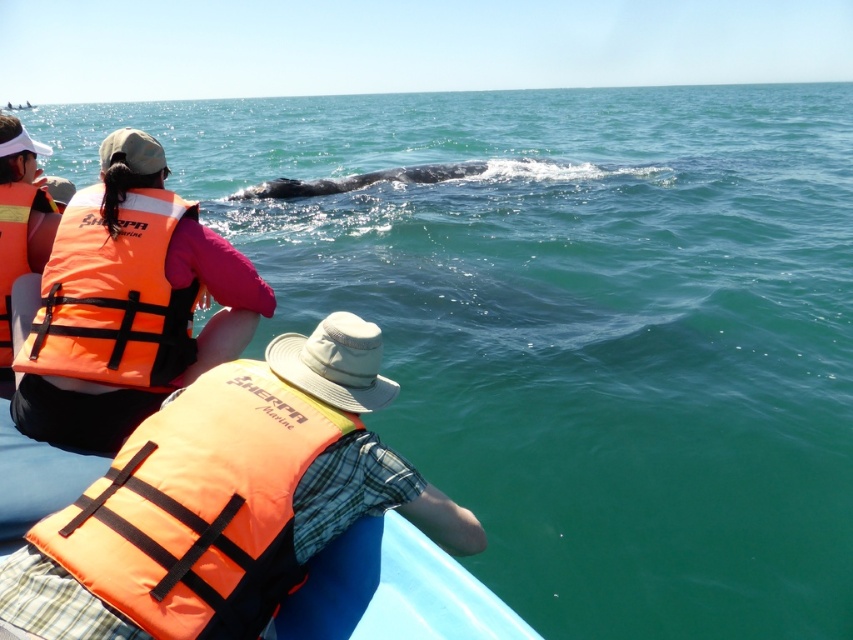
In the scene shown: You are on a whale watching boat and need to quickly grab the closest orange life jacket to secure yourself during a sudden whale splash. Which one should you choose between the orange life vest at center and the orange fabric life jacket at left?

The orange life vest at center is closer to the viewer, so you should choose the orange life vest at center to secure yourself quickly during the sudden whale splash.

In the scene shown: You are on a whale watching boat and want to know which point is closer to you. The points are point [167,340] and point [122,321]. Which point is closer to you?

Point [122,321] is closer to you because it is less further than point [167,340].

You are on a whale watching boat and need to quickly grab a life jacket. There are two orange life jackets on your left side. Which one is closer to the center of the boat? The orange life vest at left or the orange fabric life jacket at left?

The orange fabric life jacket at left is closer to the center of the boat because the orange life vest at left is positioned to its right, meaning it is further away from the center compared to the orange fabric life jacket at left.